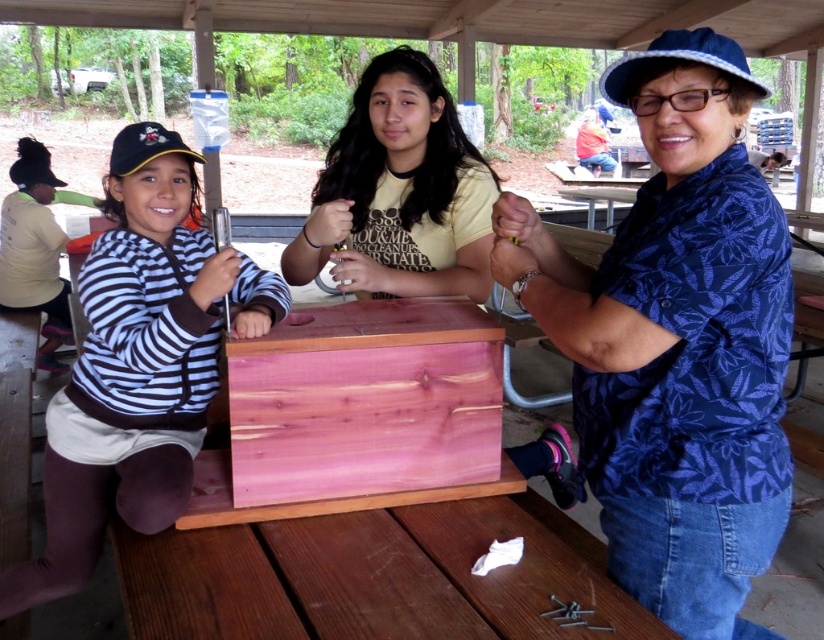
You are standing at the picnic table where the cedar wood crate at center is located. If you look directly north, what object would you see?

The cedar wood crate at center is located at point (364, 401). Since the crate is at the picnic table, looking north would show the surrounding trees as the setting is in a park area with trees around.